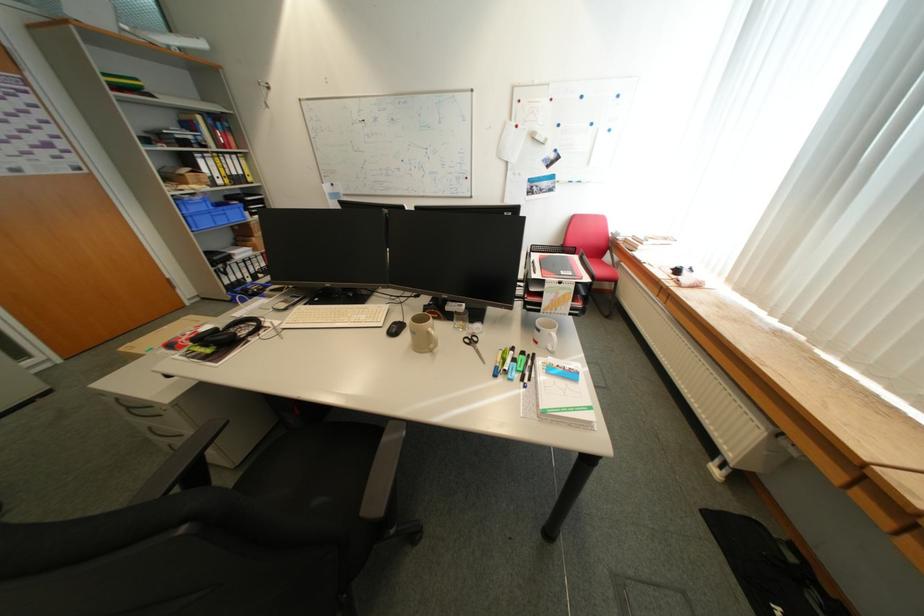
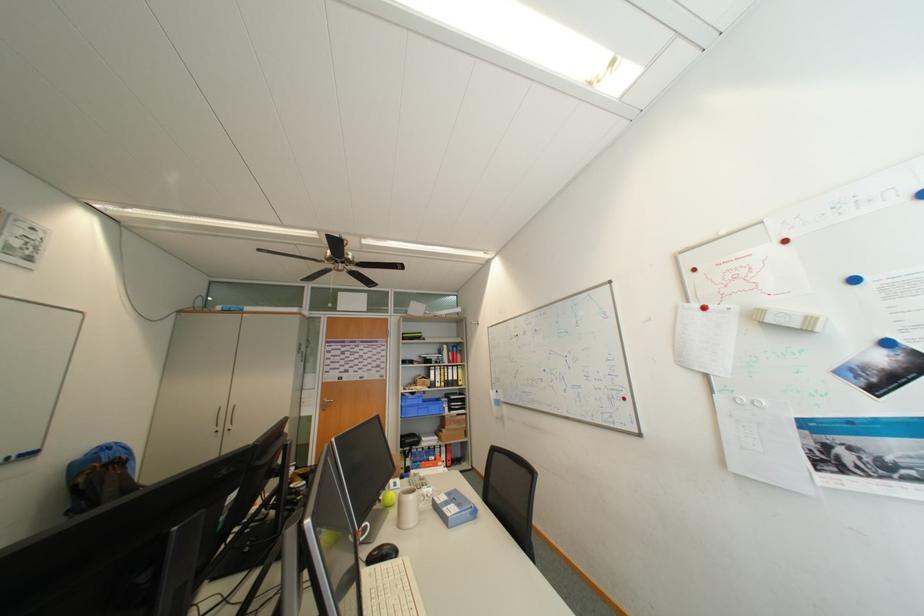
In the second image, find the point that corresponds to the point at 228,183 in the first image.

(447, 386)